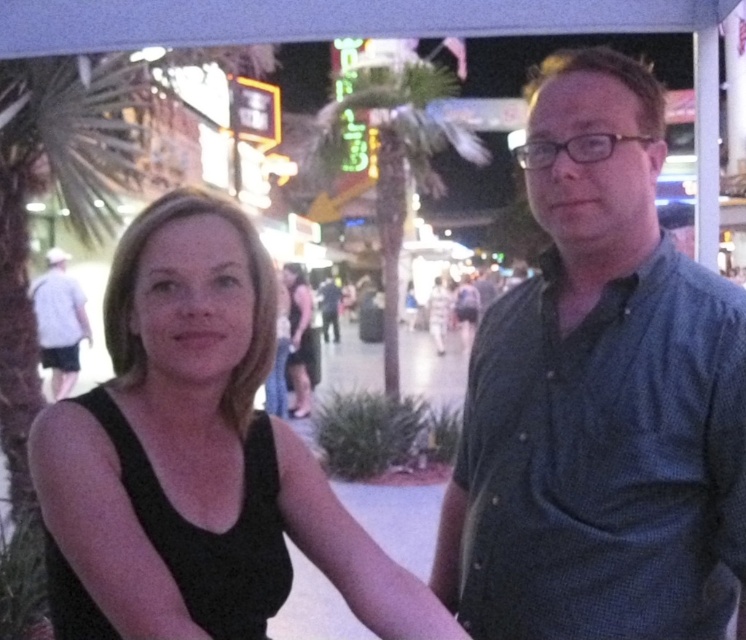
Question: Is dark blue button-up shirt at right positioned at the back of gray striped shirt at left?

Choices:
 (A) no
 (B) yes

Answer: (A)

Question: Which of the following is the closest to the observer?

Choices:
 (A) green leafy palm tree at center
 (B) gray striped shirt at left

Answer: (A)

Question: Which object appears farthest from the camera in this image?

Choices:
 (A) gray striped shirt at left
 (B) black matte tank top at center
 (C) green leafy palm tree at center
 (D) dark blue button-up shirt at right

Answer: (A)

Question: Is black matte tank top at center smaller than green leafy palm tree at center?

Choices:
 (A) no
 (B) yes

Answer: (B)

Question: Which of the following is the closest to the observer?

Choices:
 (A) (66, 300)
 (B) (128, 529)
 (C) (674, 451)
 (D) (438, 122)

Answer: (B)

Question: Is the position of dark blue button-up shirt at right less distant than that of gray striped shirt at left?

Choices:
 (A) yes
 (B) no

Answer: (A)